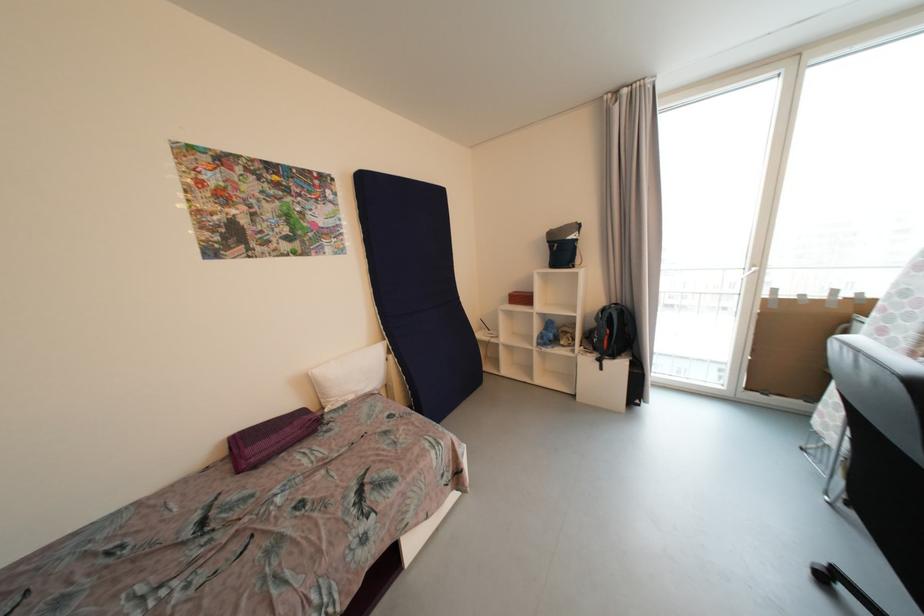
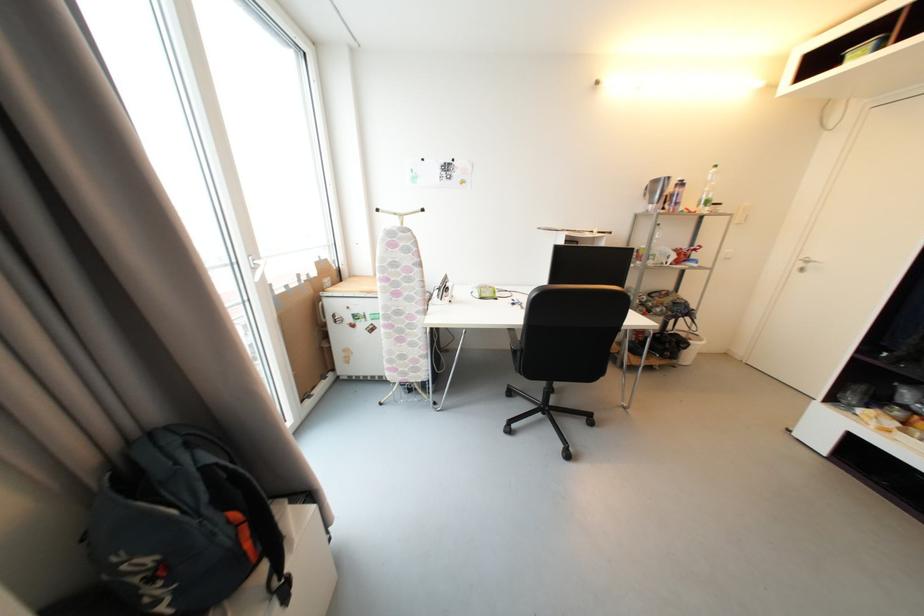
Locate, in the second image, the point that corresponds to [611,344] in the first image.

(253, 546)